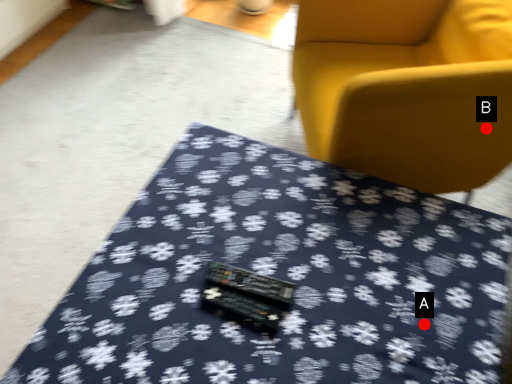
Question: Two points are circled on the image, labeled by A and B beside each circle. Which point appears closest to the camera in this image?

Choices:
 (A) A is closer
 (B) B is closer

Answer: (A)